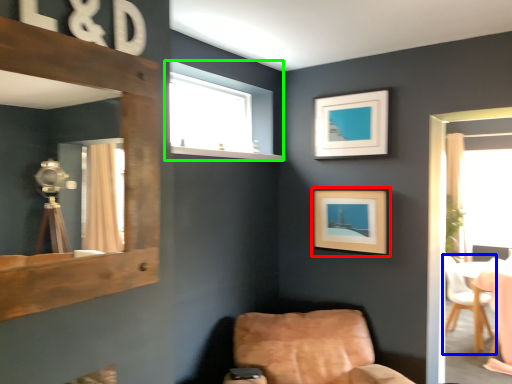
Question: Based on their relative distances, which object is farther from picture frame (highlighted by a red box)? Choose from chair (highlighted by a blue box) and window (highlighted by a green box).

Choices:
 (A) chair
 (B) window

Answer: (A)